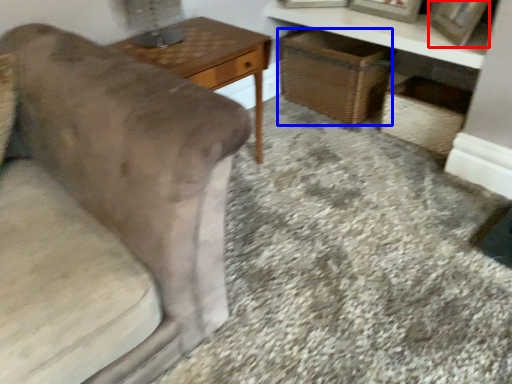
Question: Which of the following is the farthest to the observer, picture frame (highlighted by a red box) or basket (highlighted by a blue box)?

Choices:
 (A) picture frame
 (B) basket

Answer: (B)